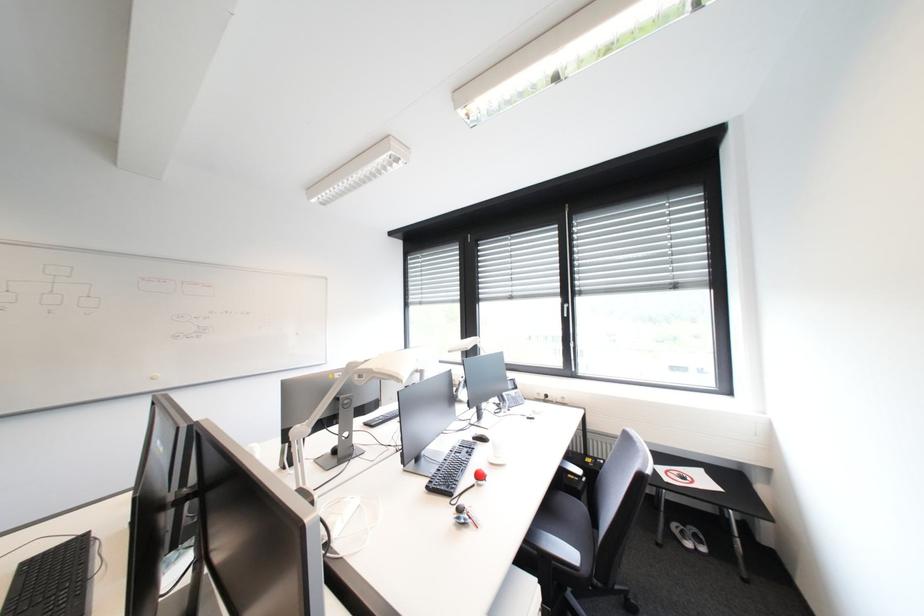
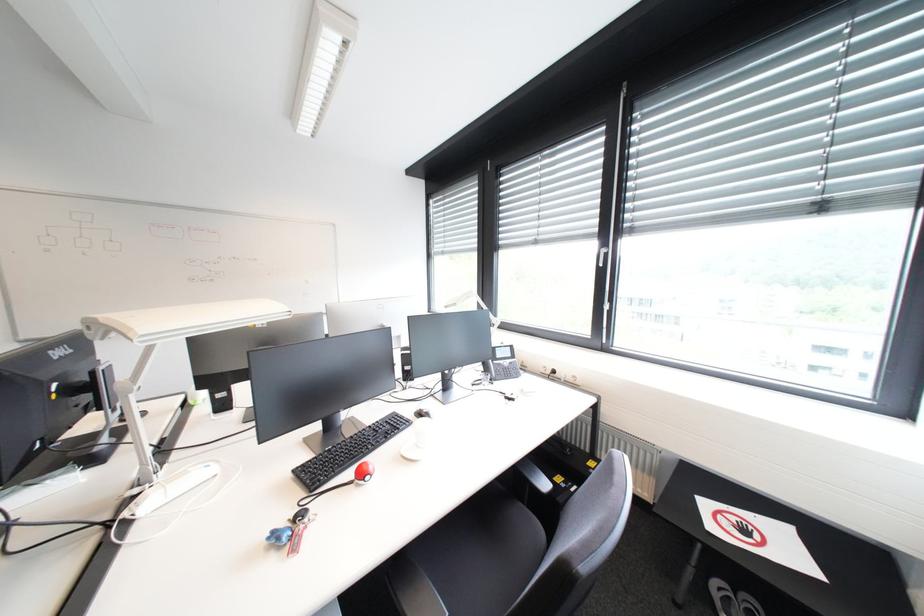
Which direction would the cameraman need to move to produce the second image?

The cameraman walked toward right, forward.